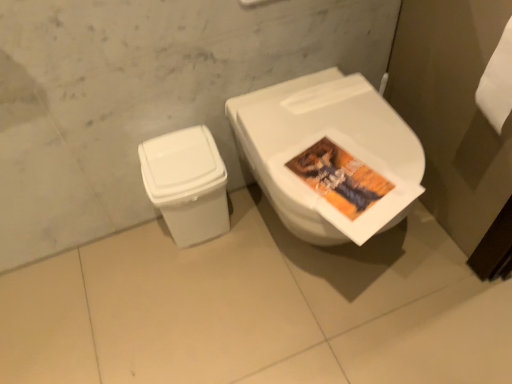
Question: Is point (410, 153) closer or farther from the camera than point (202, 127)?

Choices:
 (A) closer
 (B) farther

Answer: (A)

Question: From a real-world perspective, is white glossy toilet at center positioned above or below white plastic trash can at lower left?

Choices:
 (A) above
 (B) below

Answer: (A)

Question: In terms of height, does white glossy toilet at center look taller or shorter compared to white plastic trash can at lower left?

Choices:
 (A) tall
 (B) short

Answer: (A)

Question: Is white plastic trash can at lower left taller or shorter than white glossy toilet at center?

Choices:
 (A) short
 (B) tall

Answer: (A)

Question: From a real-world perspective, relative to white glossy toilet at center, is white plastic trash can at lower left vertically above or below?

Choices:
 (A) below
 (B) above

Answer: (A)

Question: From the image's perspective, is white plastic trash can at lower left above or below white glossy toilet at center?

Choices:
 (A) above
 (B) below

Answer: (B)

Question: Considering the positions of white plastic trash can at lower left and white glossy toilet at center in the image, is white plastic trash can at lower left bigger or smaller than white glossy toilet at center?

Choices:
 (A) small
 (B) big

Answer: (A)